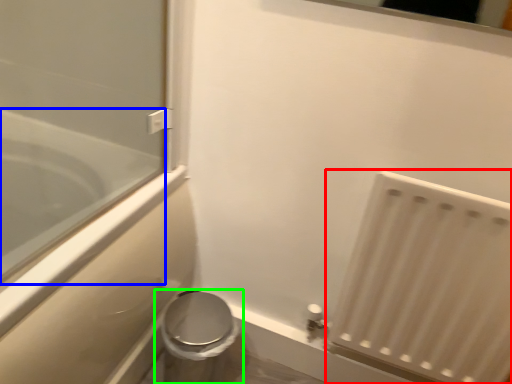
Question: Which is nearer to the radiator (highlighted by a red box)? bathtub (highlighted by a blue box) or toilet (highlighted by a green box).

Choices:
 (A) bathtub
 (B) toilet

Answer: (B)